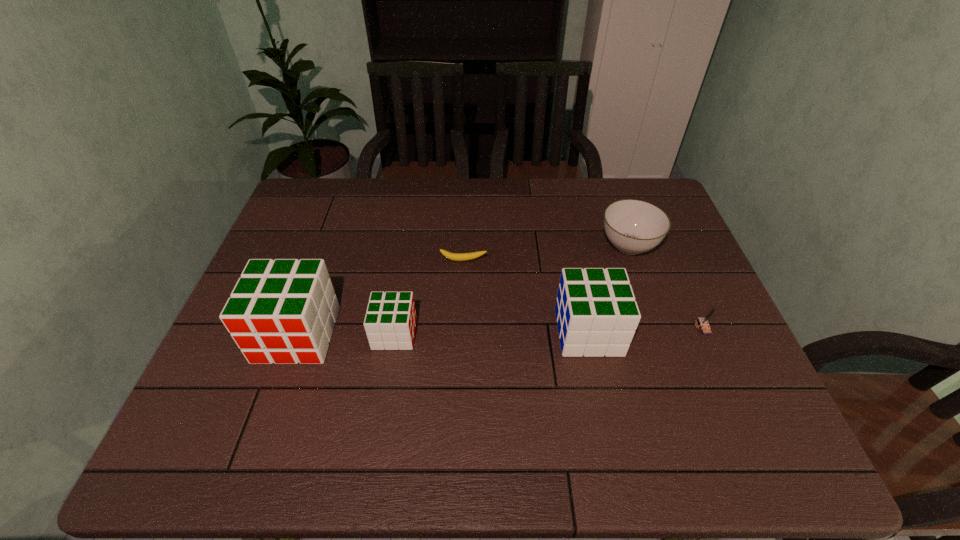
You are a GUI agent. You are given a task and a screenshot of the screen. Output one action in this format:
    pyautogui.click(x=<x>, y=<y>)
    Task: Click on the free space at the left edge of the desktop
    The height and width of the screenshot is (540, 960).
    Given the screenshot: What is the action you would take?
    pyautogui.click(x=329, y=241)

This screenshot has width=960, height=540. What are the coordinates of `vacant space at the right edge` in the screenshot? It's located at (687, 355).

This screenshot has height=540, width=960. I want to click on vacant space that's between the shortest object and the second object from right to left, so click(x=546, y=253).

Where is `vacant space that is in between the shortest object and the chinaware`? This screenshot has height=540, width=960. vacant space that is in between the shortest object and the chinaware is located at coordinates (546, 253).

At what (x,y) coordinates should I click in order to perform the action: click on unoccupied area between the second cube from right to left and the fourth object from right to left. Please return your answer as a coordinate pair (x, y). This screenshot has width=960, height=540. Looking at the image, I should click on (429, 297).

The width and height of the screenshot is (960, 540). What are the coordinates of `free space that is in between the rightmost object and the shortest cube` in the screenshot? It's located at (549, 330).

You are a GUI agent. You are given a task and a screenshot of the screen. Output one action in this format:
    pyautogui.click(x=<x>, y=<y>)
    Task: Click on the free spot between the shortest object and the rightmost cube
    
    Given the screenshot: What is the action you would take?
    [x=526, y=296]

Find the location of a particular element. The width and height of the screenshot is (960, 540). empty space that is in between the leftmost cube and the matchbox is located at coordinates (500, 331).

I want to click on free space between the chinaware and the leftmost object, so click(463, 290).

Where is `blank region between the second cube from left to right and the rightmost object`? This screenshot has height=540, width=960. blank region between the second cube from left to right and the rightmost object is located at coordinates (549, 330).